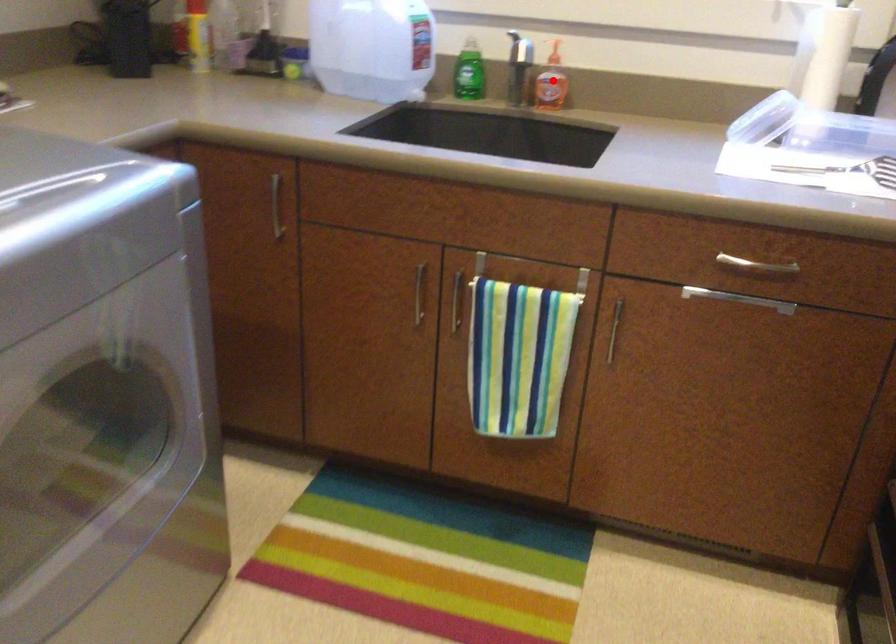
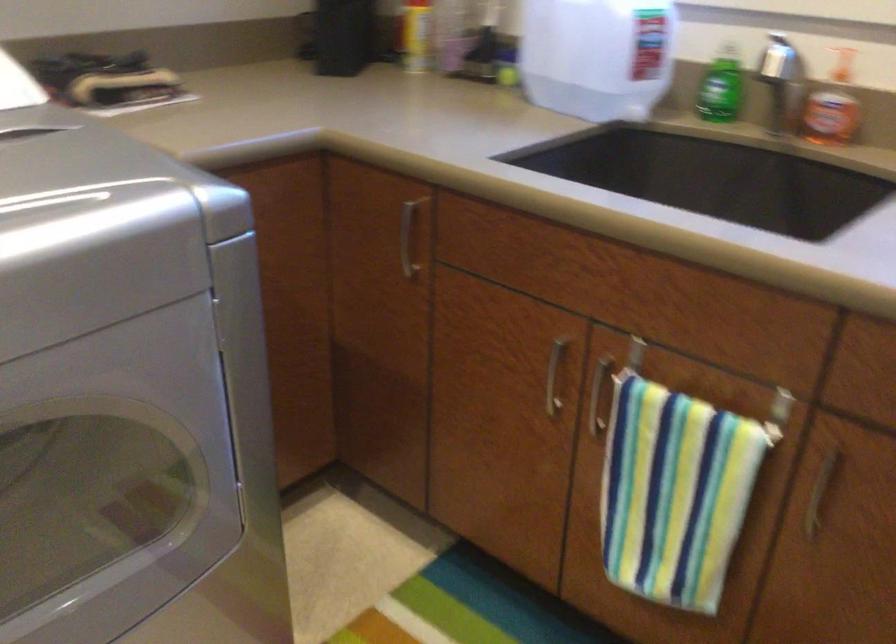
Question: I am providing you with two images of the same scene from different viewpoints. In image1, a red point is highlighted. Considering the same 3D point in image2, which of the following is correct?

Choices:
 (A) It is closer
 (B) It is farther

Answer: (A)